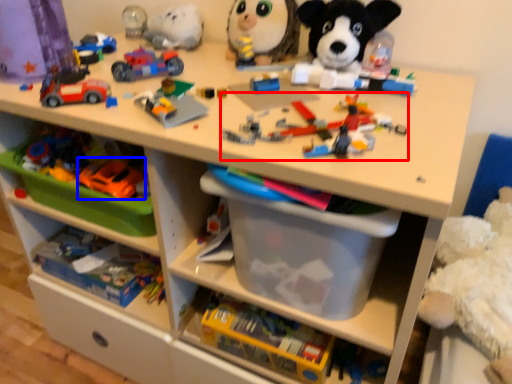
Question: Among these objects, which one is farthest to the camera, toy (highlighted by a red box) or toy (highlighted by a blue box)?

Choices:
 (A) toy
 (B) toy

Answer: (B)